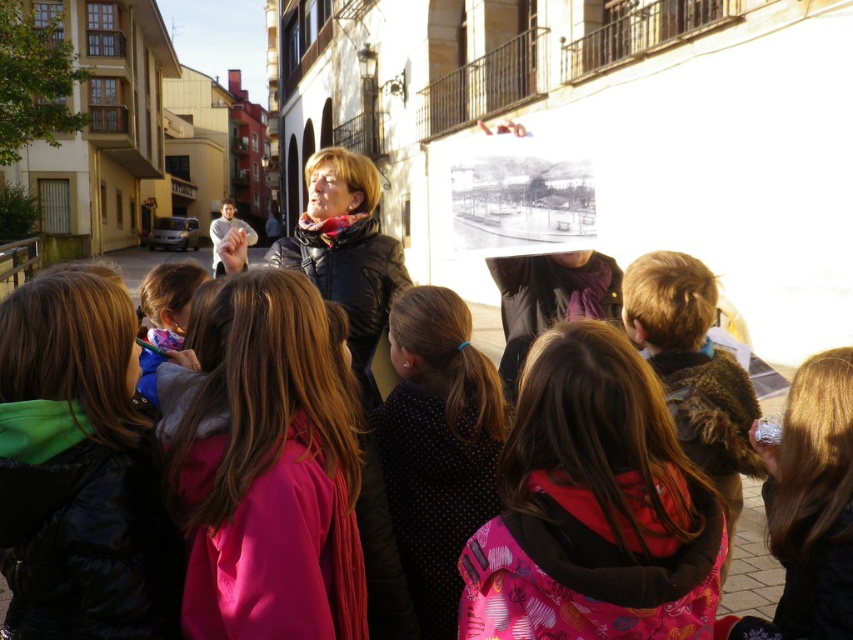
You are a fashion designer observing the outdoor scene. You notice the black puffy jacket at center and the blue fabric jacket at lower left. Which jacket is positioned lower in the image?

The black puffy jacket at center is positioned below the blue fabric jacket at lower left, so the black puffy jacket at center is lower in the image.